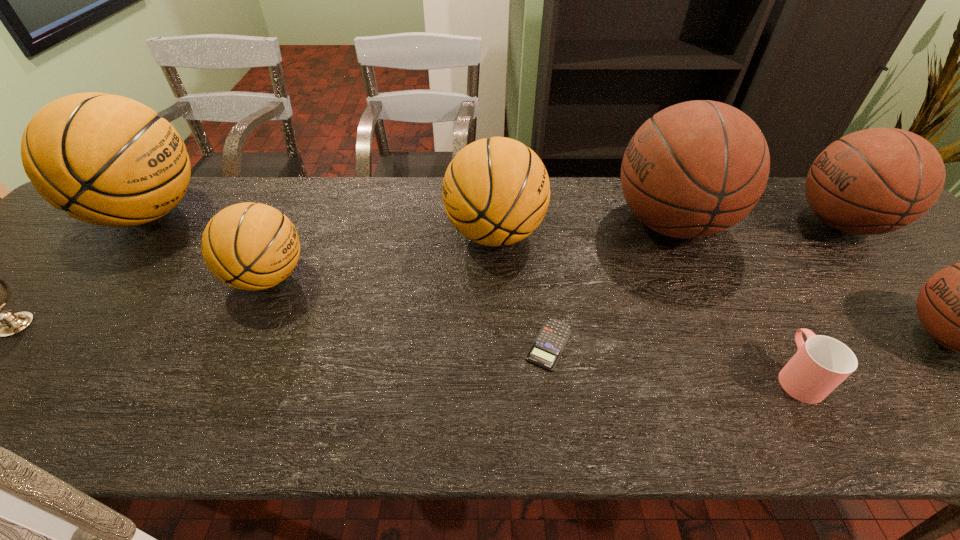
The height and width of the screenshot is (540, 960). I want to click on object that ranks as the second closest to the chalice, so click(249, 246).

At what (x,y) coordinates should I click in order to perform the action: click on the sixth closest basketball to the shortest object. Please return your answer as a coordinate pair (x, y). This screenshot has height=540, width=960. Looking at the image, I should click on (108, 160).

Select which basketball is the fifth closest to the smallest brown basketball. Please provide its 2D coordinates. Your answer should be formatted as a tuple, i.e. [(x, y)], where the tuple contains the x and y coordinates of a point satisfying the conditions above.

[(108, 160)]

Where is `orange basketball object that ranks as the third closest to the second smallest brown basketball`? orange basketball object that ranks as the third closest to the second smallest brown basketball is located at coordinates (108, 160).

In order to click on the closest orange basketball to the leftmost basketball in this screenshot , I will do `click(249, 246)`.

Identify which brown basketball is the nearest to the leftmost brown basketball. Please provide its 2D coordinates. Your answer should be formatted as a tuple, i.e. [(x, y)], where the tuple contains the x and y coordinates of a point satisfying the conditions above.

[(878, 180)]

Find the location of a particular element. Image resolution: width=960 pixels, height=540 pixels. brown basketball that is the third closest to the third shortest object is located at coordinates (959, 306).

The height and width of the screenshot is (540, 960). In order to click on free space that satisfies the following two spatial constraints: 1. on the surface of the leftmost orange basketball near the brand logo; 2. on the side of the cup with the handle in this screenshot , I will do `click(11, 376)`.

Where is `free space that satisfies the following two spatial constraints: 1. on the surface of the rightmost orange basketball near the brand logo; 2. on the side of the cup with the handle`? free space that satisfies the following two spatial constraints: 1. on the surface of the rightmost orange basketball near the brand logo; 2. on the side of the cup with the handle is located at coordinates (500, 376).

The image size is (960, 540). Find the location of `blank area in the image that satisfies the following two spatial constraints: 1. on the surface of the rightmost orange basketball near the brand logo; 2. on the side of the cup with the handle`. blank area in the image that satisfies the following two spatial constraints: 1. on the surface of the rightmost orange basketball near the brand logo; 2. on the side of the cup with the handle is located at coordinates (500, 376).